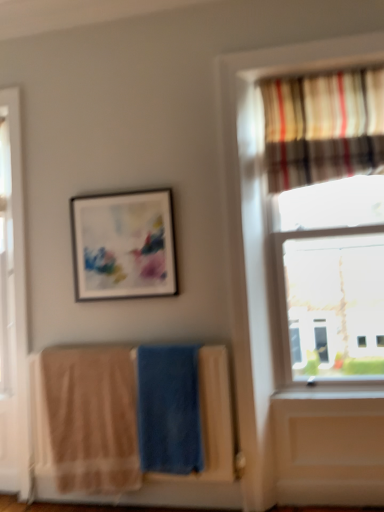
I want to click on striped fabric curtain at upper right, so click(x=322, y=126).

What do you see at coordinates (123, 245) in the screenshot? I see `matte black picture frame at upper center` at bounding box center [123, 245].

Describe the element at coordinates (92, 418) in the screenshot. I see `beige cotton beach towel at lower left, which is the second beach towel from right to left` at that location.

This screenshot has height=512, width=384. What do you see at coordinates (148, 473) in the screenshot?
I see `beige cotton towels at lower left` at bounding box center [148, 473].

This screenshot has height=512, width=384. Find the location of `striped fabric curtain at upper right`. striped fabric curtain at upper right is located at coordinates (322, 126).

Choose the correct answer: Is blue soft towel at center, placed as the 2th beach towel when sorted from left to right, inside matte black picture frame at upper center or outside it?

blue soft towel at center, placed as the 2th beach towel when sorted from left to right, is located beyond the bounds of matte black picture frame at upper center.

Which is more to the right, blue soft towel at center, acting as the first beach towel starting from the right, or matte black picture frame at upper center?

blue soft towel at center, acting as the first beach towel starting from the right.

Is striped fabric curtain at upper right in contact with blue soft towel at center, placed as the 2th beach towel when sorted from left to right?

striped fabric curtain at upper right and blue soft towel at center, placed as the 2th beach towel when sorted from left to right, are not in contact.

Between striped fabric curtain at upper right and blue soft towel at center, acting as the first beach towel starting from the right, which one appears on the left side from the viewer's perspective?

blue soft towel at center, acting as the first beach towel starting from the right, is more to the left.

Considering the points (353, 99) and (181, 466), which point is in front, point (353, 99) or point (181, 466)?

The point (181, 466) is more forward.

The image size is (384, 512). In order to click on picture frame located behind the beige cotton beach towel at lower left, which is the second beach towel from right to left in this screenshot , I will do `click(123, 245)`.

Are matte black picture frame at upper center and beige cotton beach towel at lower left, which is the second beach towel from right to left, far apart?

No, matte black picture frame at upper center is in close proximity to beige cotton beach towel at lower left, which is the second beach towel from right to left.

What's the angular difference between matte black picture frame at upper center and beige cotton beach towel at lower left, which is the second beach towel from right to left,'s facing directions?

0.0784 degrees.

Considering the relative positions of blue soft towel at center, acting as the first beach towel starting from the right, and striped fabric curtain at upper right in the image provided, is blue soft towel at center, acting as the first beach towel starting from the right, to the left of striped fabric curtain at upper right from the viewer's perspective?

Correct, you'll find blue soft towel at center, acting as the first beach towel starting from the right, to the left of striped fabric curtain at upper right.

Does point (154, 447) come farther from viewer compared to point (275, 178)?

No, it is not.

Is beige cotton beach towel at lower left, acting as the 1th beach towel starting from the left, bigger or smaller than beige cotton towels at lower left?

In the image, beige cotton beach towel at lower left, acting as the 1th beach towel starting from the left, appears to be smaller than beige cotton towels at lower left.

From a real-world perspective, is beige cotton beach towel at lower left, acting as the 1th beach towel starting from the left, above or below beige cotton towels at lower left?

beige cotton beach towel at lower left, acting as the 1th beach towel starting from the left, is above beige cotton towels at lower left.

From the image's perspective, starting from the beige cotton towels at lower left, which beach towel is the 1st one above? Please provide its 2D coordinates.

[(92, 418)]

Is beige cotton beach towel at lower left, acting as the 1th beach towel starting from the left, looking in the opposite direction of beige cotton towels at lower left?

Correct, beige cotton beach towel at lower left, acting as the 1th beach towel starting from the left, is looking away from beige cotton towels at lower left.

From the image's perspective, between beige cotton beach towel at lower left, acting as the 1th beach towel starting from the left, and matte black picture frame at upper center, who is located below?

beige cotton beach towel at lower left, acting as the 1th beach towel starting from the left, is shown below in the image.

Considering the sizes of objects beige cotton beach towel at lower left, acting as the 1th beach towel starting from the left, and matte black picture frame at upper center in the image provided, who is thinner, beige cotton beach towel at lower left, acting as the 1th beach towel starting from the left, or matte black picture frame at upper center?

Thinner between the two is matte black picture frame at upper center.

Is beige cotton beach towel at lower left, which is the second beach towel from right to left, next to matte black picture frame at upper center and touching it?

No, beige cotton beach towel at lower left, which is the second beach towel from right to left, is not in contact with matte black picture frame at upper center.

In the image, is beige cotton beach towel at lower left, acting as the 1th beach towel starting from the left, positioned in front of or behind matte black picture frame at upper center?

Clearly, beige cotton beach towel at lower left, acting as the 1th beach towel starting from the left, is in front of matte black picture frame at upper center.

Between striped fabric curtain at upper right and beige cotton beach towel at lower left, which is the second beach towel from right to left, which one appears on the left side from the viewer's perspective?

beige cotton beach towel at lower left, which is the second beach towel from right to left.

Is striped fabric curtain at upper right positioned in front of beige cotton beach towel at lower left, which is the second beach towel from right to left?

That is True.

Could beige cotton beach towel at lower left, which is the second beach towel from right to left, be considered to be inside striped fabric curtain at upper right?

That's incorrect, beige cotton beach towel at lower left, which is the second beach towel from right to left, is not inside striped fabric curtain at upper right.

From a real-world perspective, relative to beige cotton beach towel at lower left, acting as the 1th beach towel starting from the left, is striped fabric curtain at upper right vertically above or below?

From a real-world perspective, striped fabric curtain at upper right is physically above beige cotton beach towel at lower left, acting as the 1th beach towel starting from the left.

In order to click on picture frame located above the blue soft towel at center, placed as the 2th beach towel when sorted from left to right (from a real-world perspective) in this screenshot , I will do `click(123, 245)`.

You are a GUI agent. You are given a task and a screenshot of the screen. Output one action in this format:
    pyautogui.click(x=<x>, y=<y>)
    Task: Click on the curtain behind the blue soft towel at center, placed as the 2th beach towel when sorted from left to right
    
    Given the screenshot: What is the action you would take?
    pyautogui.click(x=322, y=126)

Which object lies nearer to the anchor point beige cotton towels at lower left, matte black picture frame at upper center or striped fabric curtain at upper right?

matte black picture frame at upper center lies closer to beige cotton towels at lower left than the other object.

Looking at the image, which one is located closer to beige cotton towels at lower left, striped fabric curtain at upper right or matte black picture frame at upper center?

matte black picture frame at upper center.

When comparing their distances from matte black picture frame at upper center, does beige cotton beach towel at lower left, which is the second beach towel from right to left, or striped fabric curtain at upper right seem further?

striped fabric curtain at upper right is positioned further to the anchor matte black picture frame at upper center.

From the picture: Looking at the image, which one is located further to blue soft towel at center, acting as the first beach towel starting from the right, striped fabric curtain at upper right or matte black picture frame at upper center?

The object further to blue soft towel at center, acting as the first beach towel starting from the right, is striped fabric curtain at upper right.

Based on their spatial positions, is beige cotton beach towel at lower left, acting as the 1th beach towel starting from the left, or matte black picture frame at upper center closer to striped fabric curtain at upper right?

matte black picture frame at upper center is positioned closer to the anchor striped fabric curtain at upper right.

From the image, which object appears to be nearer to beige cotton beach towel at lower left, which is the second beach towel from right to left, beige cotton towels at lower left or blue soft towel at center, placed as the 2th beach towel when sorted from left to right?

beige cotton towels at lower left lies closer to beige cotton beach towel at lower left, which is the second beach towel from right to left, than the other object.

Considering their positions, is matte black picture frame at upper center positioned closer to blue soft towel at center, placed as the 2th beach towel when sorted from left to right, than striped fabric curtain at upper right?

matte black picture frame at upper center.

Looking at this image, from the image, which object appears to be farther from blue soft towel at center, acting as the first beach towel starting from the right, beige cotton beach towel at lower left, acting as the 1th beach towel starting from the left, or beige cotton towels at lower left?

The object further to blue soft towel at center, acting as the first beach towel starting from the right, is beige cotton beach towel at lower left, acting as the 1th beach towel starting from the left.

At what (x,y) coordinates should I click in order to perform the action: click on picture frame that lies between striped fabric curtain at upper right and beige cotton towels at lower left from top to bottom. Please return your answer as a coordinate pair (x, y). The image size is (384, 512). Looking at the image, I should click on (123, 245).

What are the coordinates of `laundry located between beige cotton beach towel at lower left, which is the second beach towel from right to left, and blue soft towel at center, acting as the first beach towel starting from the right, in the left-right direction` in the screenshot? It's located at (148, 473).

Where is `beach towel between matte black picture frame at upper center and beige cotton beach towel at lower left, acting as the 1th beach towel starting from the left, in the up-down direction`? This screenshot has width=384, height=512. beach towel between matte black picture frame at upper center and beige cotton beach towel at lower left, acting as the 1th beach towel starting from the left, in the up-down direction is located at coordinates (169, 409).

Find the location of `picture frame between striped fabric curtain at upper right and blue soft towel at center, placed as the 2th beach towel when sorted from left to right, in the up-down direction`. picture frame between striped fabric curtain at upper right and blue soft towel at center, placed as the 2th beach towel when sorted from left to right, in the up-down direction is located at coordinates (123, 245).